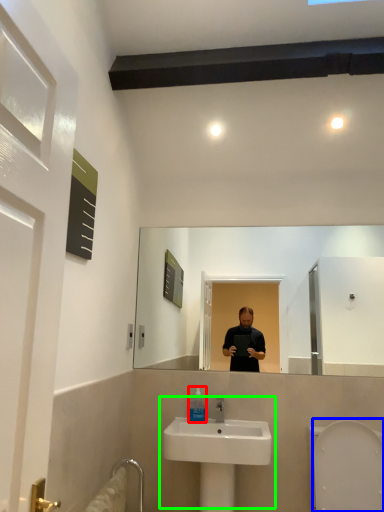
Question: Which object is positioned closest to mouthwash (highlighted by a red box)? Select from bidet (highlighted by a blue box) and sink (highlighted by a green box).

Choices:
 (A) bidet
 (B) sink

Answer: (B)